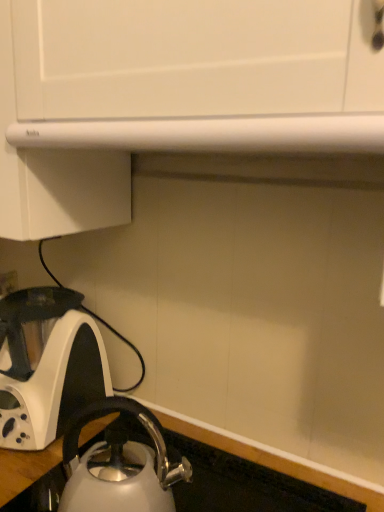
Question: Can you confirm if white glossy kettle at lower left, placed as the second kettle when sorted from right to left, is wider than satin silver kettle at lower left, which appears as the first kettle when viewed from the right?

Choices:
 (A) no
 (B) yes

Answer: (B)

Question: Is white glossy kettle at lower left, which appears as the 2th kettle when viewed from the front, taller than satin silver kettle at lower left, marked as the second kettle in a back-to-front arrangement?

Choices:
 (A) yes
 (B) no

Answer: (A)

Question: Is white glossy kettle at lower left, arranged as the first kettle when viewed from the left, next to satin silver kettle at lower left, the second kettle when ordered from left to right, and touching it?

Choices:
 (A) yes
 (B) no

Answer: (B)

Question: Is white glossy kettle at lower left, which is the first kettle from back to front, closer to the viewer compared to satin silver kettle at lower left, which appears as the first kettle when viewed from the right?

Choices:
 (A) no
 (B) yes

Answer: (A)

Question: From the image's perspective, is white glossy kettle at lower left, which appears as the 2th kettle when viewed from the front, beneath satin silver kettle at lower left, which appears as the first kettle when viewed from the right?

Choices:
 (A) no
 (B) yes

Answer: (A)

Question: In the image, is satin silver kettle at lower left, positioned as the 1th kettle in front-to-back order, positioned in front of or behind white glossy countertop at lower left?

Choices:
 (A) front
 (B) behind

Answer: (B)

Question: From a real-world perspective, is satin silver kettle at lower left, marked as the second kettle in a back-to-front arrangement, positioned above or below white glossy countertop at lower left?

Choices:
 (A) above
 (B) below

Answer: (A)

Question: In terms of size, does satin silver kettle at lower left, which appears as the first kettle when viewed from the right, appear bigger or smaller than white glossy countertop at lower left?

Choices:
 (A) small
 (B) big

Answer: (A)

Question: In the image, is satin silver kettle at lower left, positioned as the 1th kettle in front-to-back order, on the left side or the right side of white glossy countertop at lower left?

Choices:
 (A) left
 (B) right

Answer: (A)

Question: Is white glossy kettle at lower left, which is the first kettle from back to front, taller or shorter than satin silver kettle at lower left, positioned as the 1th kettle in front-to-back order?

Choices:
 (A) short
 (B) tall

Answer: (B)

Question: Looking at the image, does white glossy kettle at lower left, which appears as the 2th kettle when viewed from the front, seem bigger or smaller compared to satin silver kettle at lower left, marked as the second kettle in a back-to-front arrangement?

Choices:
 (A) big
 (B) small

Answer: (A)

Question: Based on their positions, is white glossy kettle at lower left, which appears as the 2th kettle when viewed from the front, located to the left or right of satin silver kettle at lower left, which appears as the first kettle when viewed from the right?

Choices:
 (A) left
 (B) right

Answer: (A)

Question: Is white glossy kettle at lower left, which is the first kettle from back to front, in front of or behind satin silver kettle at lower left, which appears as the first kettle when viewed from the right, in the image?

Choices:
 (A) front
 (B) behind

Answer: (B)

Question: Is point (213, 466) positioned closer to the camera than point (173, 468)?

Choices:
 (A) farther
 (B) closer

Answer: (A)

Question: Is white glossy countertop at lower left inside the boundaries of satin silver kettle at lower left, the second kettle when ordered from left to right, or outside?

Choices:
 (A) outside
 (B) inside

Answer: (A)